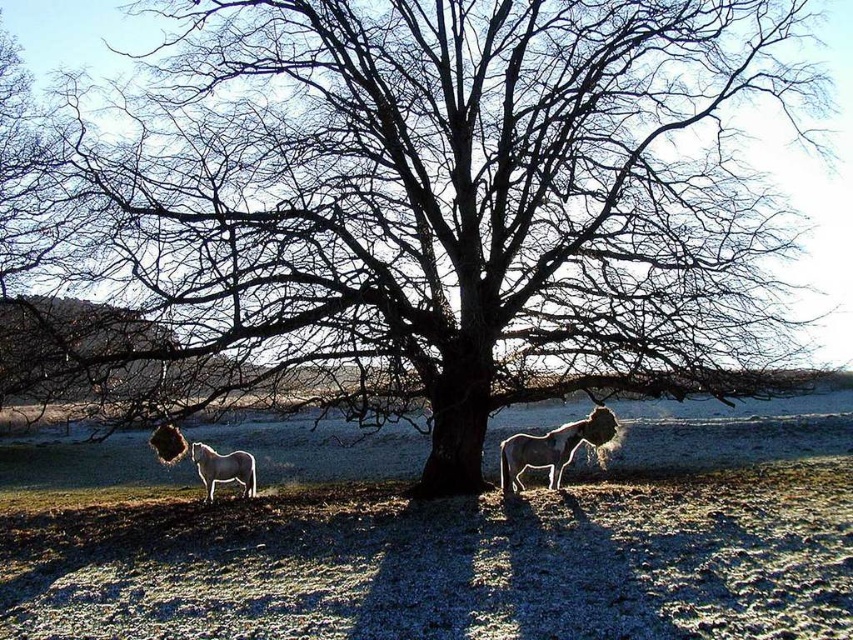
You are standing in the field and see the point marked as point [552,449]. What object is located at that point?

The point [552,449] corresponds to the white glossy horse at center.

You are a farmer who needs to separate two horses with a fence. You have a 20 feet long fence panel. The scene shows a white glossy horse at center and a white glossy horse at lower left. Can the fence panel be placed between them to separate them completely?

The distance between the white glossy horse at center and the white glossy horse at lower left is 17.33 feet. Since the fence panel is 20 feet long, it is longer than the distance between them, so the fence panel can be placed between them to separate them completely.

You are a photographer trying to capture both white glossy horse at center and white glossy horse at lower left in a single shot. Which horse should you focus on first to ensure both are in frame?

You should focus on the white glossy horse at center first since it is closer to you than the white glossy horse at lower left, so adjusting the camera angle to include both would require ensuring the foreground horse is properly framed before checking the background horse.